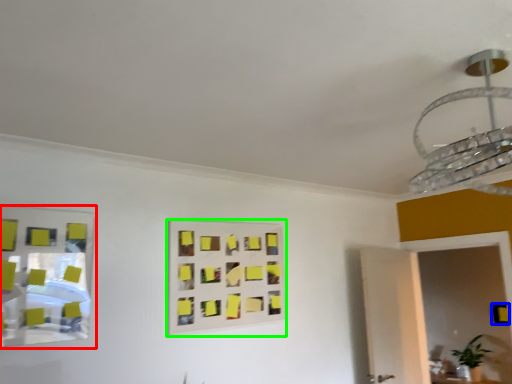
Question: Which object is positioned farthest from mirror (highlighted by a red box)? Select from square (highlighted by a blue box) and rectangle (highlighted by a green box).

Choices:
 (A) square
 (B) rectangle

Answer: (A)